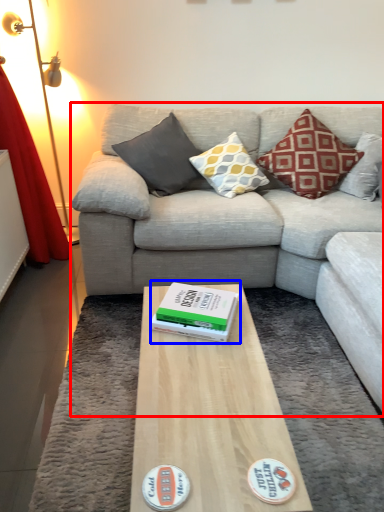
Question: Which point is closer to the camera, studio couch (highlighted by a red box) or paperback book (highlighted by a blue box)?

Choices:
 (A) studio couch
 (B) paperback book

Answer: (A)